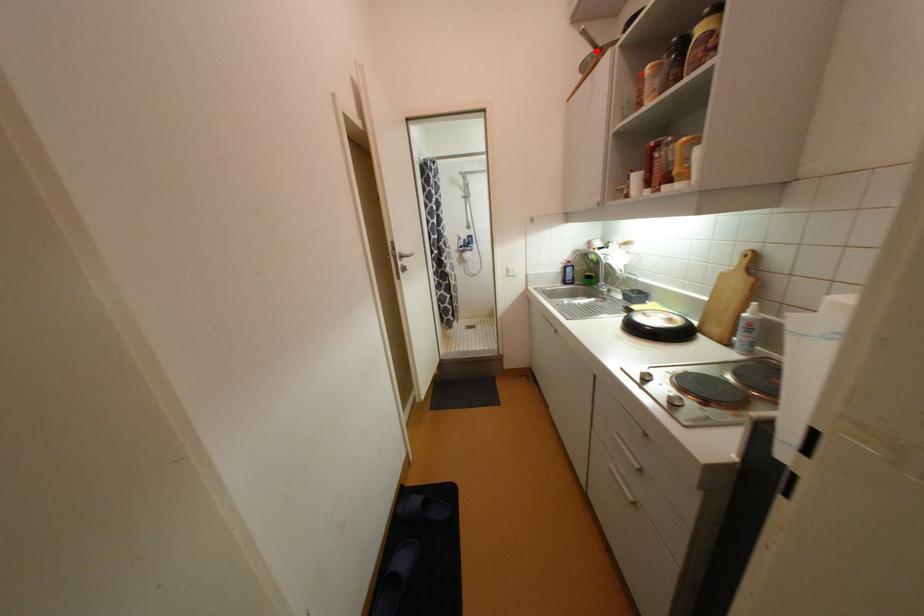
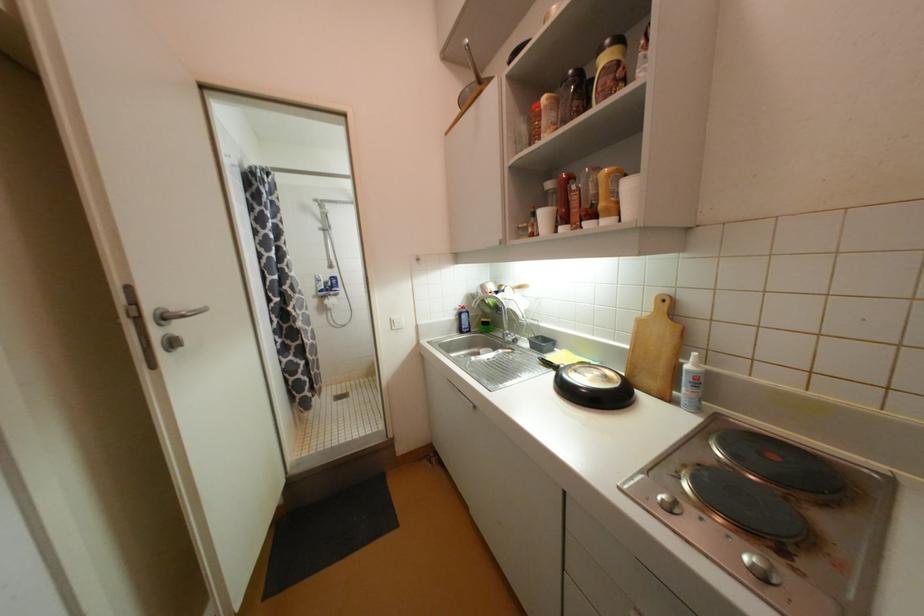
Find the pixel in the second image that matches the highlighted location in the first image.

(479, 79)